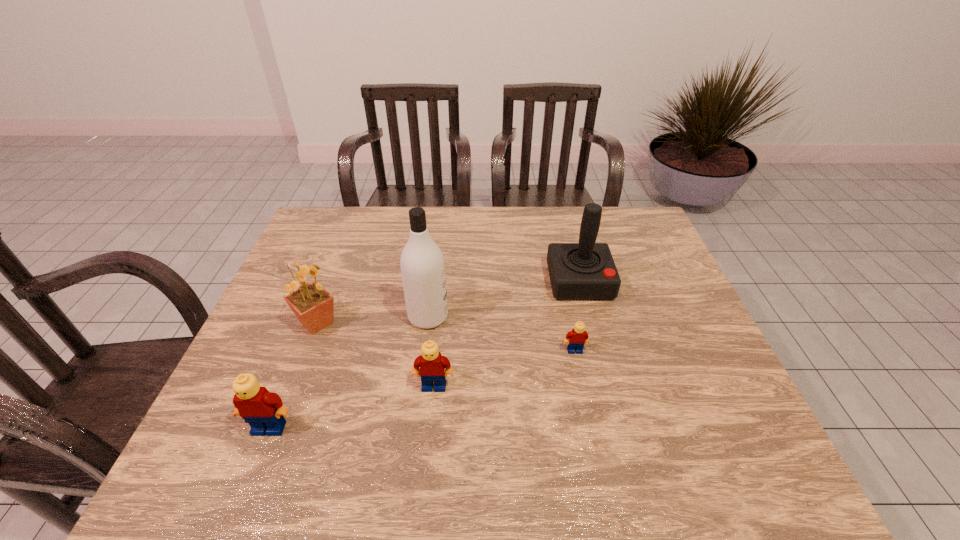
Identify the location of the nearest object. (264, 411).

Identify the location of the nearest Lego. (264, 411).

Identify the location of the second Lego from left to right. This screenshot has height=540, width=960. (432, 364).

Find the location of a particular element. the second shortest object is located at coordinates (432, 364).

This screenshot has height=540, width=960. Find the location of `the fourth farthest object`. the fourth farthest object is located at coordinates (576, 338).

Where is `the farthest Lego`? The width and height of the screenshot is (960, 540). the farthest Lego is located at coordinates tap(576, 338).

Locate an element on the screen. shampoo is located at coordinates (422, 264).

Identify the location of joystick. (586, 270).

Find the location of a particular element. This screenshot has width=960, height=540. the fourth shortest object is located at coordinates (313, 306).

Locate an element on the screen. The width and height of the screenshot is (960, 540). vacant space located on the front-facing side of the second Lego from left to right is located at coordinates (432, 412).